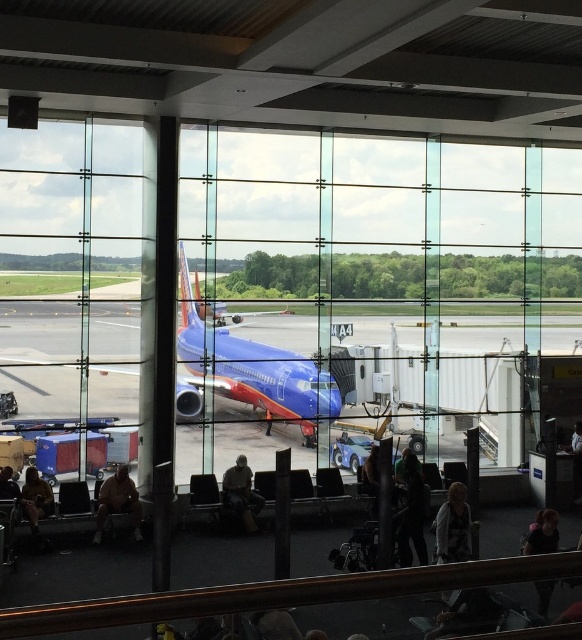
You are a traveler who just arrived at the airport and see two jackets near the jet bridge. You need to retrieve your dark brown leather jacket at lower right. Which direction should you move relative to the brown leather jacket at lower left to find it?

The dark brown leather jacket at lower right is located to the right of the brown leather jacket at lower left. To retrieve it, move to the right side of the brown leather jacket at lower left.

Based on the photo, what are the coordinates of the blue glossy airplane at center?

The coordinates of the blue glossy airplane at center are (250, 371).

You are a traveler who just arrived at the airport and see a light brown leather jacket at lower left and a dark brown leather jacket at lower right. Which one is smaller?

The light brown leather jacket at lower left is smaller compared to the dark brown leather jacket at lower right.